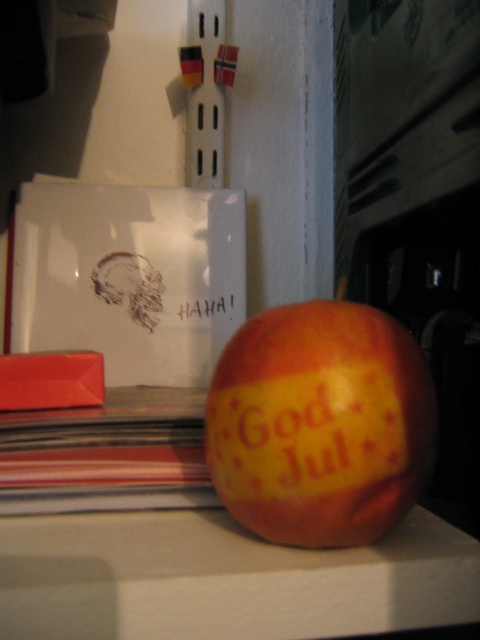
Question: Among these objects, which one is farthest from the camera?

Choices:
 (A) yellow matte text at center
 (B) red matte apple at center

Answer: (A)

Question: Among these points, which one is nearest to the camera?

Choices:
 (A) (192, 301)
 (B) (409, 364)

Answer: (B)

Question: Does red matte apple at center appear on the left side of yellow matte text at center?

Choices:
 (A) yes
 (B) no

Answer: (B)

Question: Can you confirm if red matte apple at center is bigger than yellow matte text at center?

Choices:
 (A) yes
 (B) no

Answer: (A)

Question: Can you confirm if red matte apple at center is wider than yellow matte text at center?

Choices:
 (A) no
 (B) yes

Answer: (B)

Question: Among these points, which one is nearest to the camera?

Choices:
 (A) (300, 396)
 (B) (181, 312)

Answer: (A)